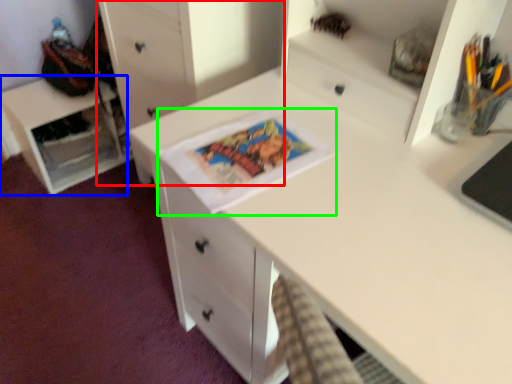
Question: Which object is positioned farthest from chest of drawers (highlighted by a red box)? Select from cabinetry (highlighted by a blue box) and comic book (highlighted by a green box).

Choices:
 (A) cabinetry
 (B) comic book

Answer: (A)